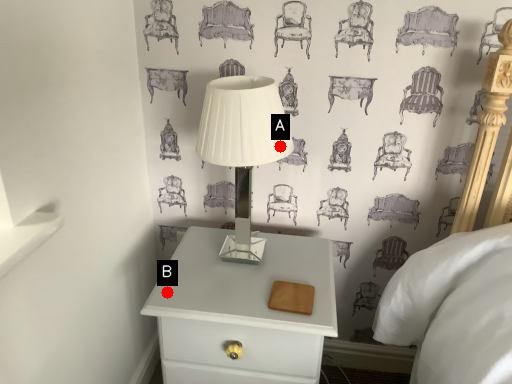
Question: Two points are circled on the image, labeled by A and B beside each circle. Which of the following is the closest to the observer?

Choices:
 (A) A is closer
 (B) B is closer

Answer: (A)